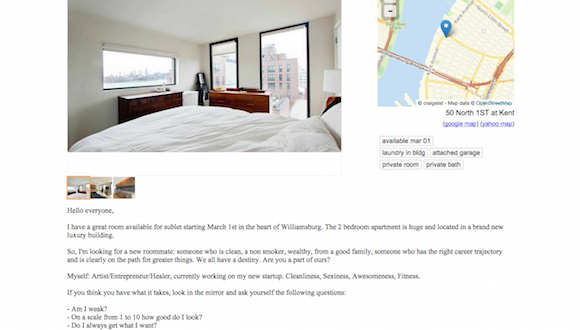
Where is `wooden sideboard`? The height and width of the screenshot is (330, 580). wooden sideboard is located at coordinates (72, 190), (84, 192), (142, 106), (235, 100).